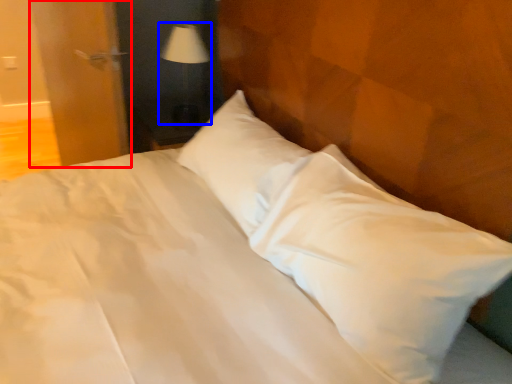
Question: Which of the following is the farthest to the observer, door (highlighted by a red box) or table lamp (highlighted by a blue box)?

Choices:
 (A) door
 (B) table lamp

Answer: (B)